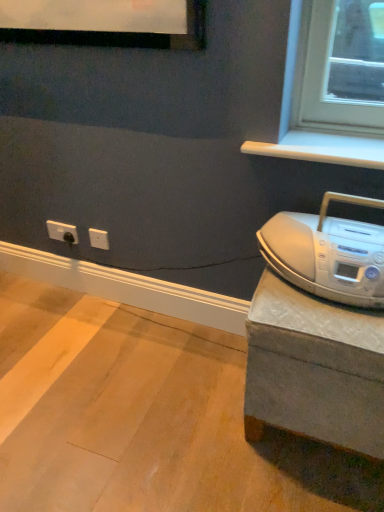
Question: From the image's perspective, is silver metallic boombox at right located beneath gray concrete at right?

Choices:
 (A) yes
 (B) no

Answer: (B)

Question: From a real-world perspective, does silver metallic boombox at right stand above gray concrete at right?

Choices:
 (A) no
 (B) yes

Answer: (B)

Question: Is there a large distance between silver metallic boombox at right and gray concrete at right?

Choices:
 (A) no
 (B) yes

Answer: (A)

Question: Is silver metallic boombox at right shorter than gray concrete at right?

Choices:
 (A) no
 (B) yes

Answer: (A)

Question: Does silver metallic boombox at right turn towards gray concrete at right?

Choices:
 (A) no
 (B) yes

Answer: (A)

Question: From a real-world perspective, does silver metallic boombox at right sit lower than gray concrete at right?

Choices:
 (A) no
 (B) yes

Answer: (A)

Question: From the image's perspective, is silver metallic boombox at right under white plastic outlet at lower left?

Choices:
 (A) no
 (B) yes

Answer: (B)

Question: From the image's perspective, is silver metallic boombox at right above white plastic outlet at lower left?

Choices:
 (A) no
 (B) yes

Answer: (A)

Question: Is silver metallic boombox at right positioned with its back to white plastic outlet at lower left?

Choices:
 (A) yes
 (B) no

Answer: (B)

Question: Is silver metallic boombox at right directly adjacent to white plastic outlet at lower left?

Choices:
 (A) yes
 (B) no

Answer: (B)

Question: Would you consider silver metallic boombox at right to be distant from white plastic outlet at lower left?

Choices:
 (A) yes
 (B) no

Answer: (A)

Question: Is silver metallic boombox at right aimed at white plastic outlet at lower left?

Choices:
 (A) no
 (B) yes

Answer: (A)

Question: Is gray concrete at right in contact with white plastic outlet at lower left?

Choices:
 (A) no
 (B) yes

Answer: (A)